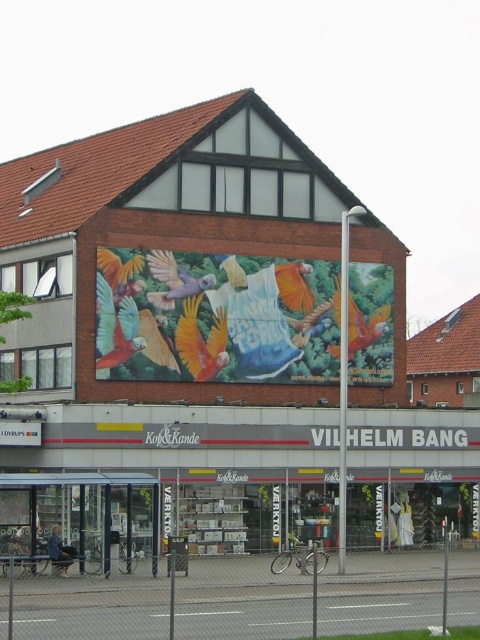
You are a pedestrian standing in front of the building with the red roof and brick facade. You see the vibrant painted mural at center and the transparent glass bus stop at lower left. Which object is located to the right of the other?

The vibrant painted mural at center is positioned on the right side of transparent glass bus stop at lower left.

Based on the photo, you are standing in front of the building with the red tiled roof and large mural of parrots. You see two points marked on the facade. If you were to walk towards the building, which point would you reach first, point (223, 358) or point (14, 500)?

Point (14, 500) is closer to the camera, so you would reach it first when approaching the building.